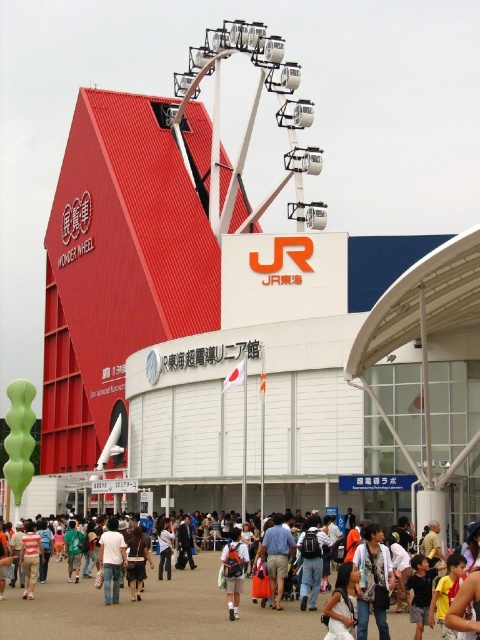
You are standing in front of the building and see the light brown backpack at center and the blue denim shorts at center. Which item is positioned to the right of the other?

The light brown backpack at center is to the right of the blue denim shorts at center.

You are standing in front of the building complex and want to know the distance to the point labeled as point (x=368, y=604). Can you estimate how far it is from your current position?

The point labeled point (x=368, y=604) is 110.43 feet away from the viewer.